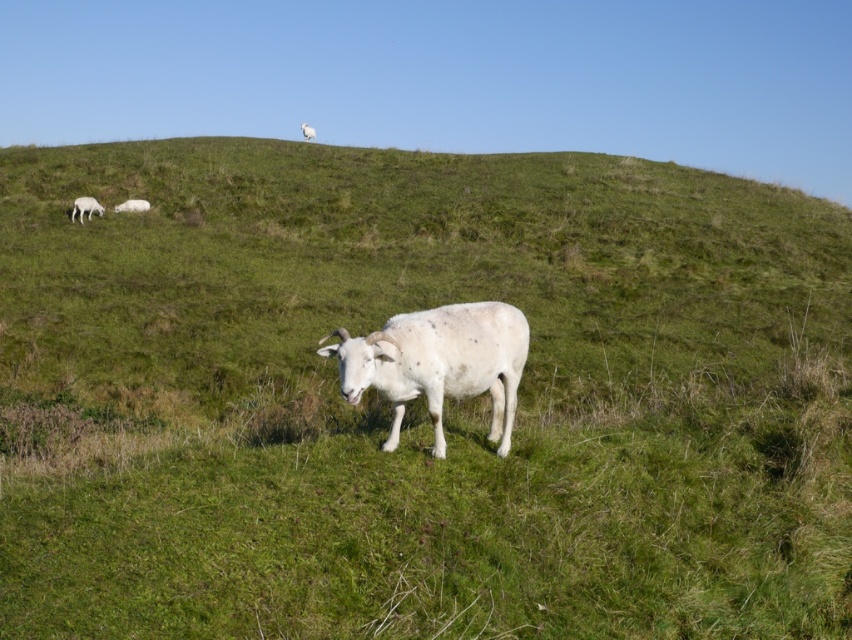
Question: Which point is farther to the camera?

Choices:
 (A) (98, 214)
 (B) (481, 362)
 (C) (130, 204)
 (D) (314, 136)

Answer: (D)

Question: Can you confirm if white woolen goat at center is thinner than white woolly sheep at upper left?

Choices:
 (A) no
 (B) yes

Answer: (A)

Question: Where is white woolly sheep at left located in relation to white woolly sheep at upper center in the image?

Choices:
 (A) below
 (B) above

Answer: (A)

Question: Which object is positioned closest to the white woolly sheep at upper center?

Choices:
 (A) white woolly sheep at left
 (B) white woolly sheep at upper left

Answer: (B)

Question: Is white woolen goat at center smaller than white woolly sheep at upper center?

Choices:
 (A) no
 (B) yes

Answer: (B)

Question: Which point is farther from the camera taking this photo?

Choices:
 (A) (415, 346)
 (B) (88, 196)
 (C) (304, 122)
 (D) (148, 204)

Answer: (C)